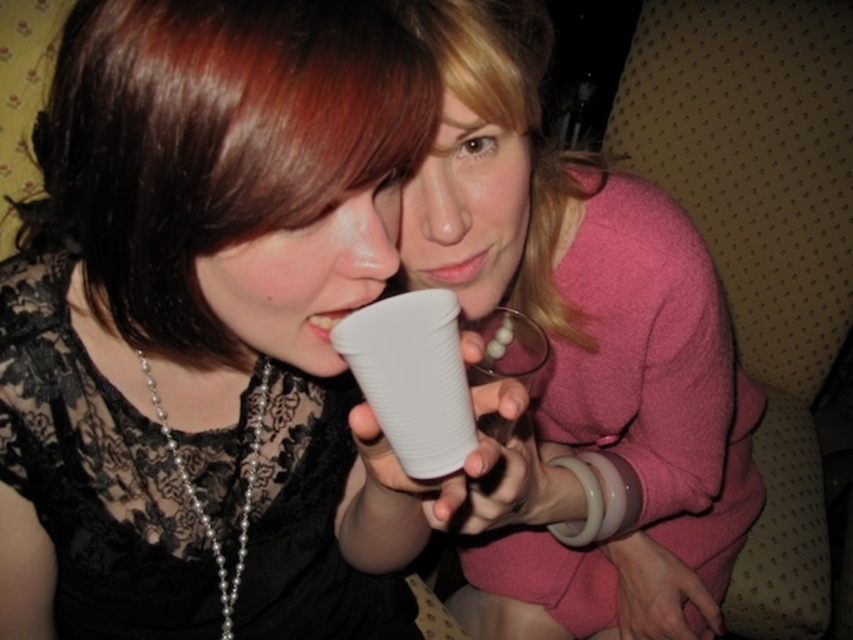
What do you see at coordinates (514, 129) in the screenshot?
I see `blondehair at upper center` at bounding box center [514, 129].

Does blondehair at upper center come behind white plastic cup at center?

Yes, it is behind white plastic cup at center.

Does point (509, 54) lie behind point (432, 458)?

Yes, it is.

The width and height of the screenshot is (853, 640). I want to click on blondehair at upper center, so click(514, 129).

Is matte white cup at center thinner than white plastic cup at center?

Incorrect, matte white cup at center's width is not less than white plastic cup at center's.

Can you confirm if matte white cup at center is bigger than white plastic cup at center?

Correct, matte white cup at center is larger in size than white plastic cup at center.

The width and height of the screenshot is (853, 640). What do you see at coordinates (207, 324) in the screenshot?
I see `matte white cup at center` at bounding box center [207, 324].

Identify the location of matte white cup at center. The image size is (853, 640). (207, 324).

Between pink matte sweater at upper right and brown shiny hair at left, which one has less height?

With less height is brown shiny hair at left.

Can you confirm if pink matte sweater at upper right is positioned to the right of brown shiny hair at left?

Correct, you'll find pink matte sweater at upper right to the right of brown shiny hair at left.

Does point (590, 602) come closer to viewer compared to point (332, 60)?

No.

Image resolution: width=853 pixels, height=640 pixels. In order to click on pink matte sweater at upper right in this screenshot , I will do `click(578, 346)`.